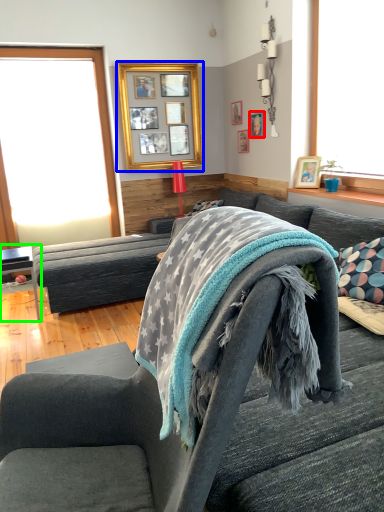
Question: Which object is positioned closest to picture frame (highlighted by a red box)? Select from picture frame (highlighted by a blue box) and table (highlighted by a green box).

Choices:
 (A) picture frame
 (B) table

Answer: (A)